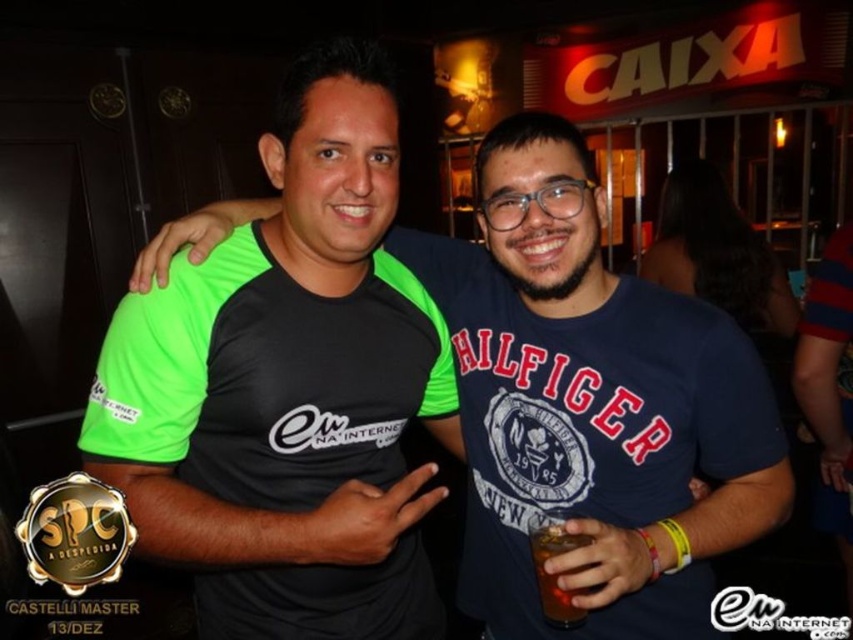
Question: Is black matte t-shirt at center behind brown liquid at center?

Choices:
 (A) yes
 (B) no

Answer: (B)

Question: Can you confirm if neon green fabric shirt at center is positioned above brown liquid at center?

Choices:
 (A) no
 (B) yes

Answer: (B)

Question: Can you confirm if black matte t-shirt at center is positioned above brown liquid at center?

Choices:
 (A) yes
 (B) no

Answer: (A)

Question: Considering the real-world distances, which object is closest to the neon green fabric shirt at center?

Choices:
 (A) brown liquid at center
 (B) black matte t-shirt at center

Answer: (B)

Question: Which point is closer to the camera?

Choices:
 (A) neon green fabric shirt at center
 (B) brown liquid at center

Answer: (A)

Question: Among these objects, which one is farthest from the camera?

Choices:
 (A) brown liquid at center
 (B) neon green fabric shirt at center
 (C) black matte t-shirt at center

Answer: (A)